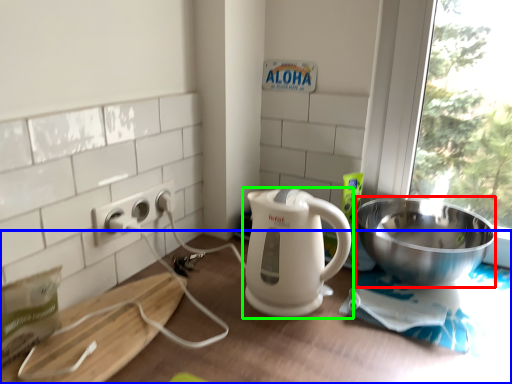
Question: Which is nearer to the bowl (highlighted by a red box)? table (highlighted by a blue box) or kitchen appliance (highlighted by a green box).

Choices:
 (A) table
 (B) kitchen appliance

Answer: (A)